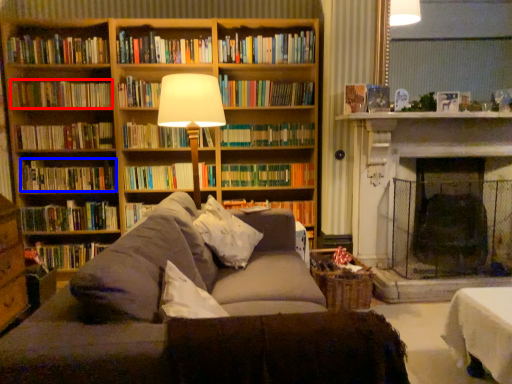
Question: Which of the following is the farthest to the observer, book (highlighted by a red box) or book (highlighted by a blue box)?

Choices:
 (A) book
 (B) book

Answer: (B)